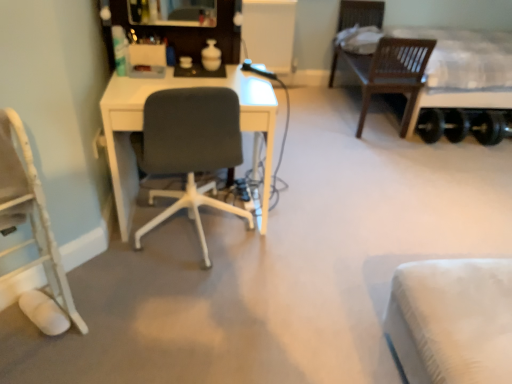
Locate an element on the screen. vacant area that lies to the right of white fabric chair at lower left, the 2th chair when ordered from right to left is located at coordinates (106, 338).